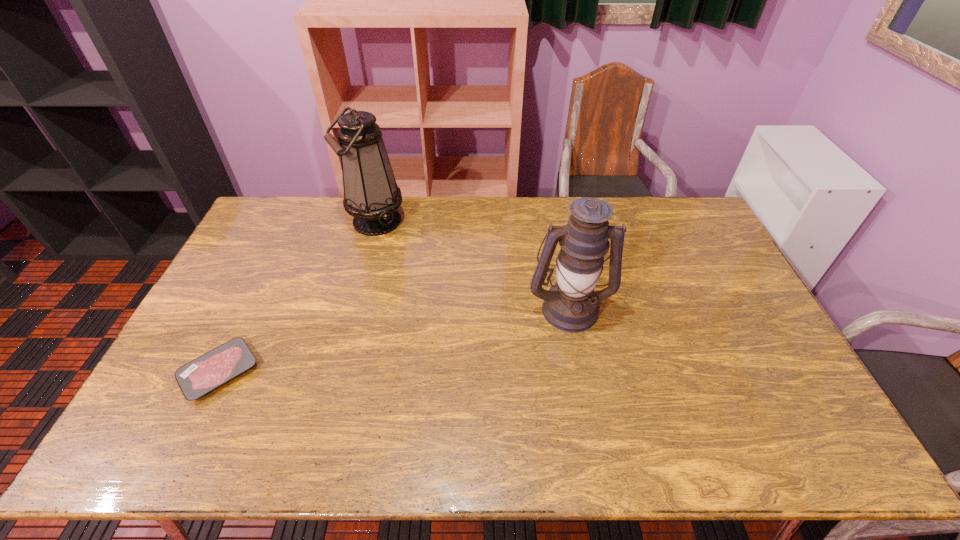
The height and width of the screenshot is (540, 960). I want to click on the farther oil lamp, so click(x=371, y=195).

You are a GUI agent. You are given a task and a screenshot of the screen. Output one action in this format:
    pyautogui.click(x=<x>, y=<y>)
    Task: Click on the farthest object
    Image resolution: width=960 pixels, height=540 pixels.
    Given the screenshot: What is the action you would take?
    pyautogui.click(x=371, y=195)

The width and height of the screenshot is (960, 540). Find the location of `the right oil lamp`. the right oil lamp is located at coordinates (570, 305).

Identify the location of the second nearest object. (570, 305).

This screenshot has height=540, width=960. I want to click on the leftmost object, so click(x=197, y=378).

This screenshot has width=960, height=540. What are the coordinates of `steak` in the screenshot? It's located at (197, 378).

The width and height of the screenshot is (960, 540). Identify the location of free location located 0.200m on the left of the second object from right to left. (293, 221).

The image size is (960, 540). Find the location of `vacant area located on the left of the nearer oil lamp`. vacant area located on the left of the nearer oil lamp is located at coordinates (455, 308).

Locate an element on the screen. vacant space located on the right of the nearest object is located at coordinates (406, 372).

The height and width of the screenshot is (540, 960). I want to click on object that is at the far edge, so click(371, 195).